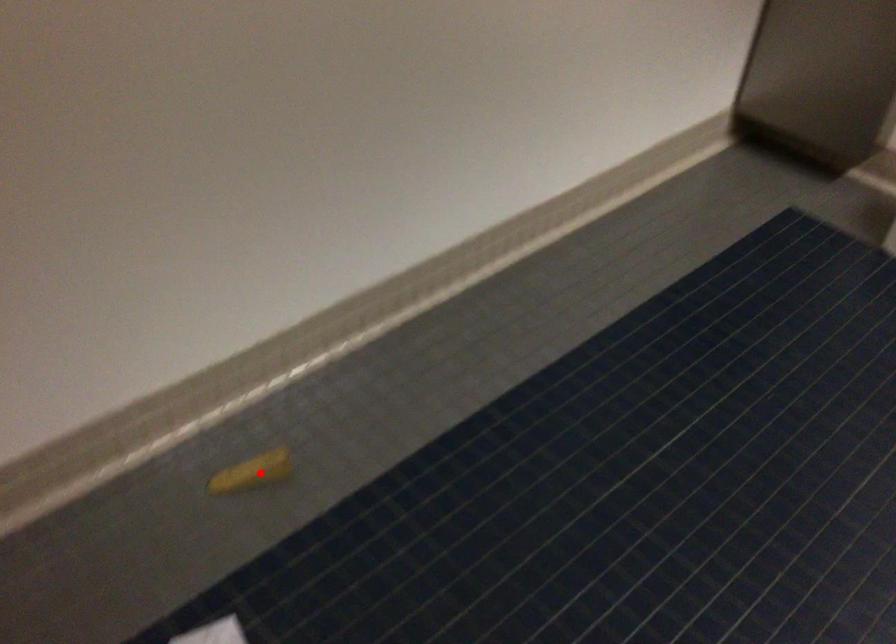
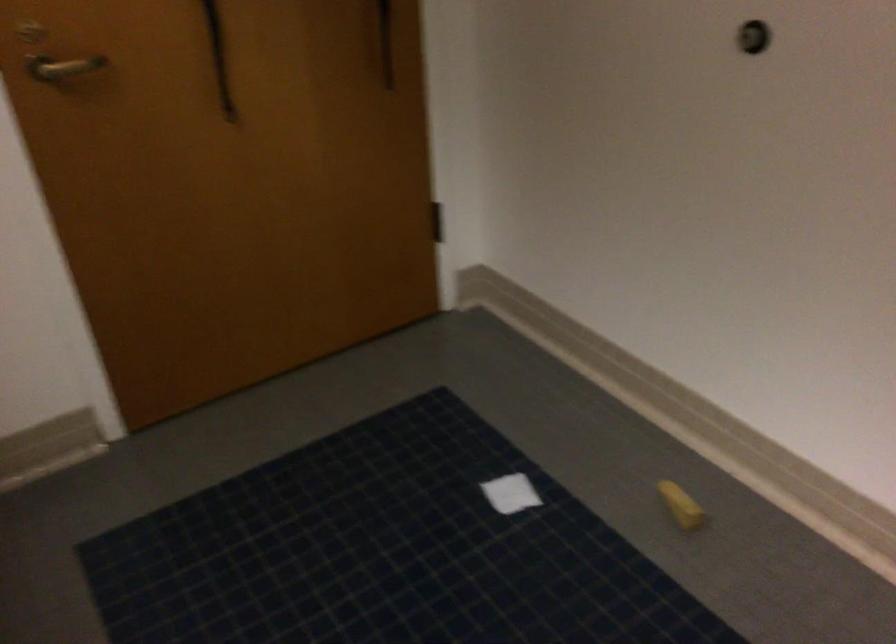
The point at the highlighted location is marked in the first image. Where is the corresponding point in the second image?

(681, 505)